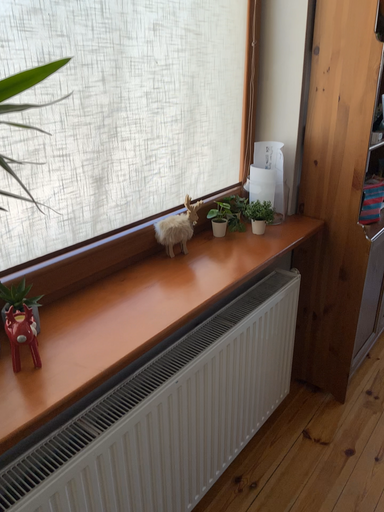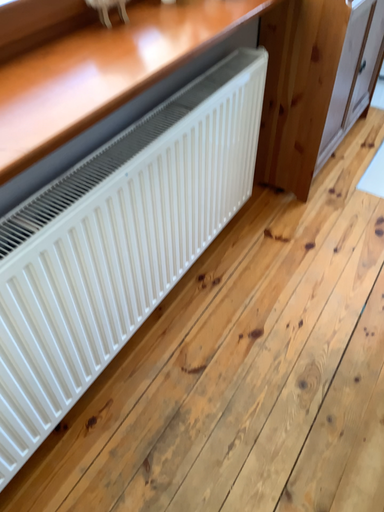
Question: Which way did the camera rotate in the video?

Choices:
 (A) rotated downward
 (B) rotated upward

Answer: (A)